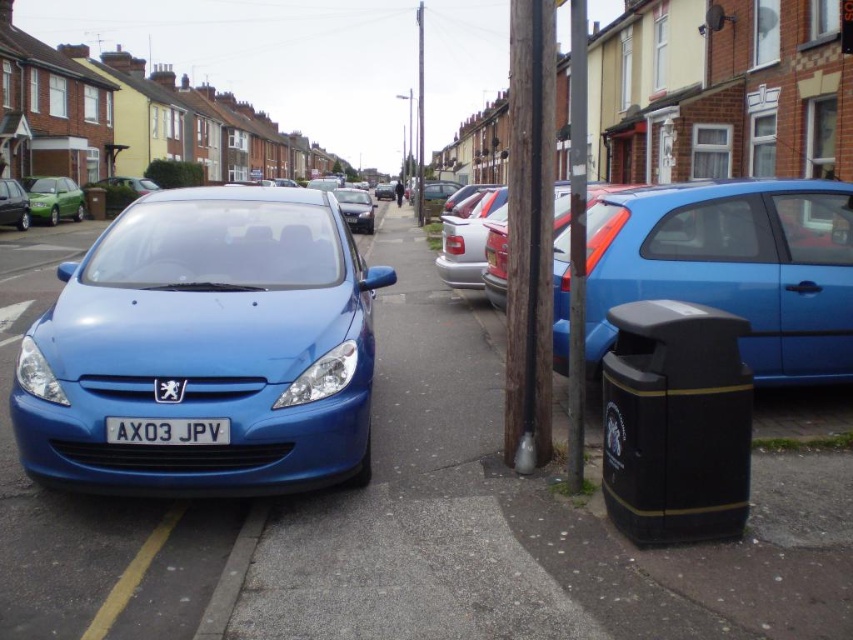
Question: Is metallic pole at center further to the viewer compared to green matte sedan at left?

Choices:
 (A) yes
 (B) no

Answer: (B)

Question: Which point is farther to the camera?

Choices:
 (A) (53, 182)
 (B) (527, 378)
 (C) (582, 480)

Answer: (A)

Question: Is metallic pole at center bigger than blue plastic license plate at center?

Choices:
 (A) yes
 (B) no

Answer: (A)

Question: Considering the real-world distances, which object is farthest from the satin black sedan at center?

Choices:
 (A) matte blue hatchback at left
 (B) metallic pole at center

Answer: (B)

Question: Is metallic pole at center positioned at the back of blue plastic license plate at center?

Choices:
 (A) yes
 (B) no

Answer: (A)

Question: Which point appears farthest from the camera in this image?

Choices:
 (A) (582, 77)
 (B) (65, 184)
 (C) (154, 440)

Answer: (B)